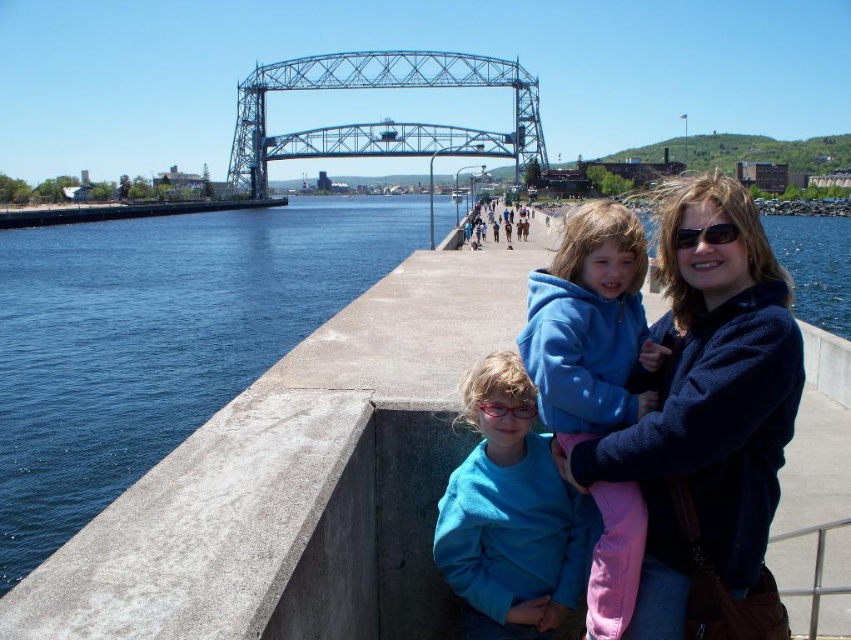
In the scene shown: You are standing on the walkway and want to hand a gift to the person wearing the matte blue sweater at center and the sunglasses at center. Which item will you reach first if you move forward?

The matte blue sweater at center is closer to the viewer than the sunglasses at center, so you will reach the matte blue sweater at center first.

You are standing on the walkway and want to take a photo of both the blue concrete water at left and the blue metallic bridge at center. Which object should you focus on first to ensure both are in frame?

You should focus on the blue concrete water at left first because it is closer to the viewer than the blue metallic bridge at center, allowing you to frame both objects effectively.

You are standing on the concrete walkway and want to know the distance between the blue concrete water at left and the silver metallic rail at lower right. Can you estimate how far apart they are?

The blue concrete water at left is 112.06 meters from the silver metallic rail at lower right, so they are approximately 112.06 meters apart.